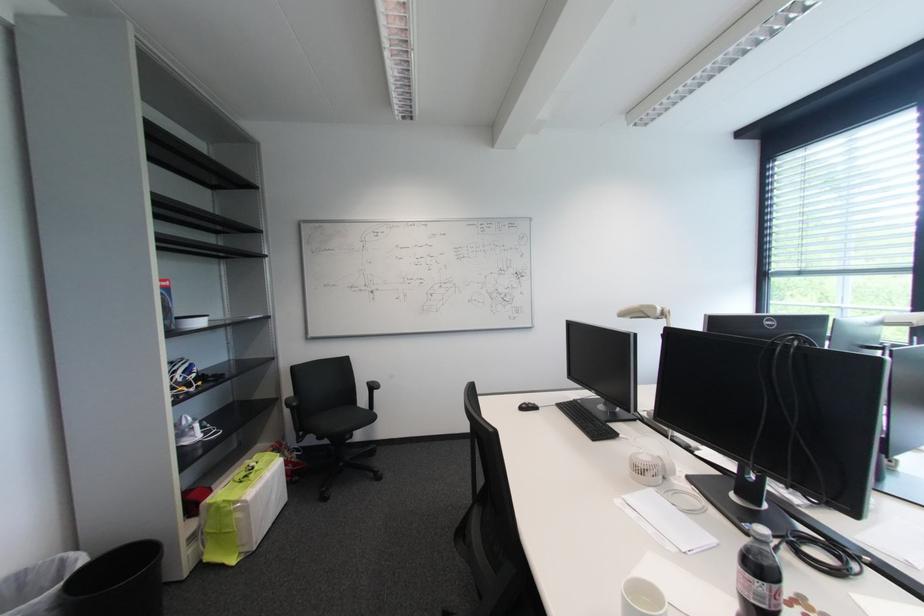
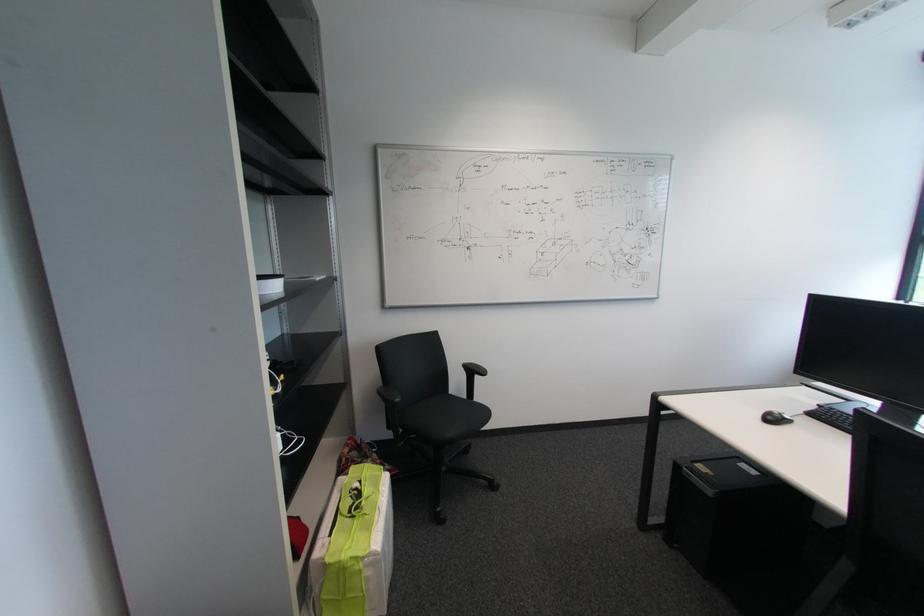
The point at (373, 410) is marked in the first image. Where is the corresponding point in the second image?

(471, 399)